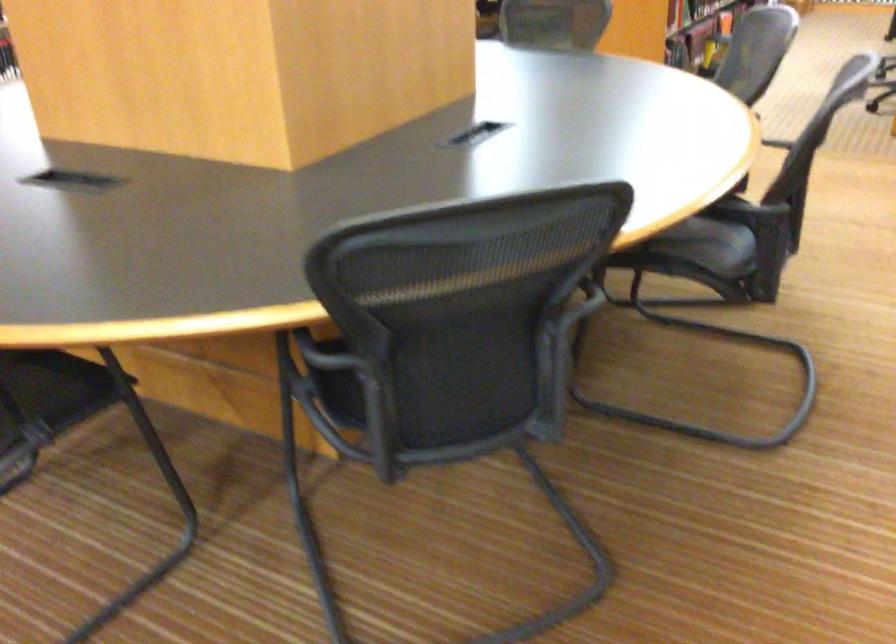
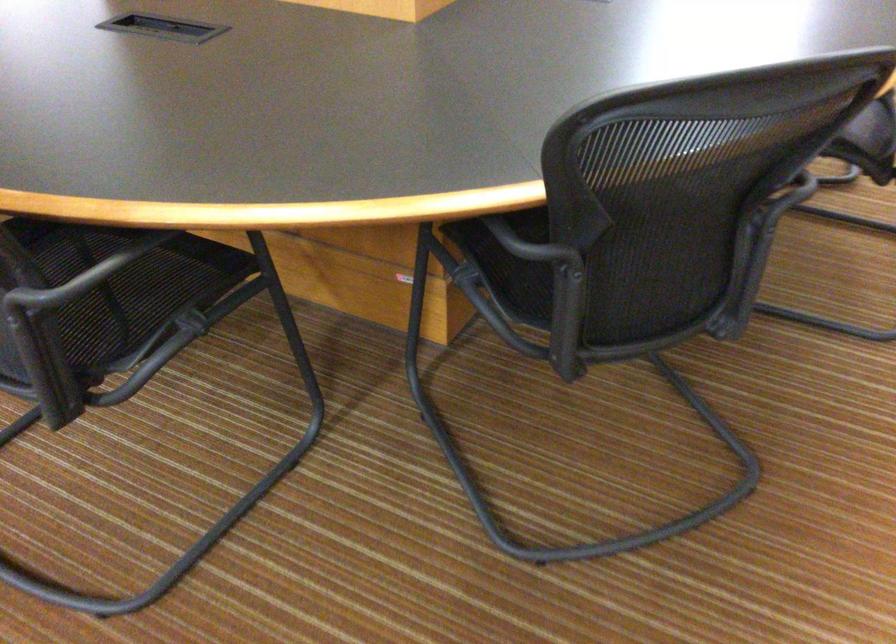
In the second image, find the point that corresponds to [294,351] in the first image.

(507, 236)